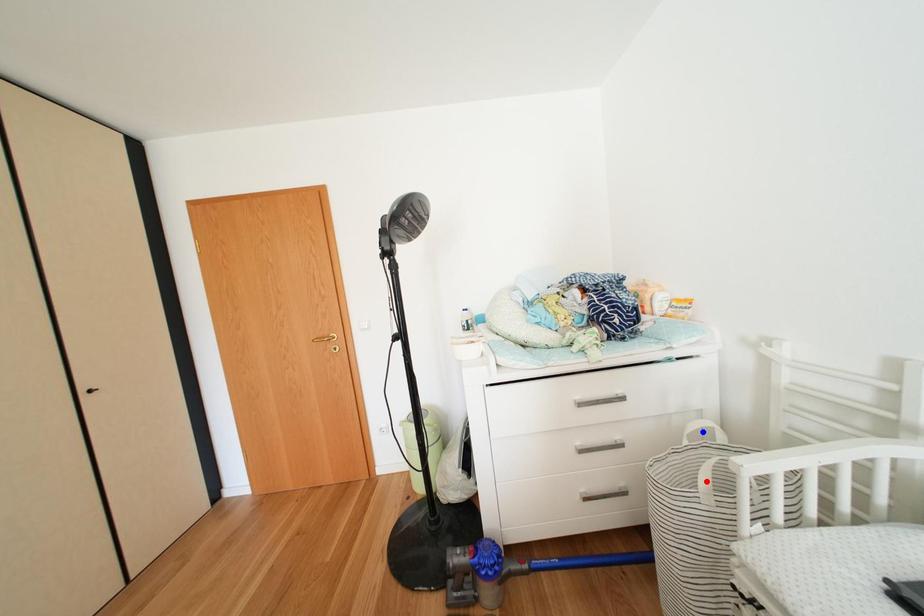
Question: Which of the two points in the image is closer to the camera?

Choices:
 (A) Blue point is closer.
 (B) Red point is closer.

Answer: (B)